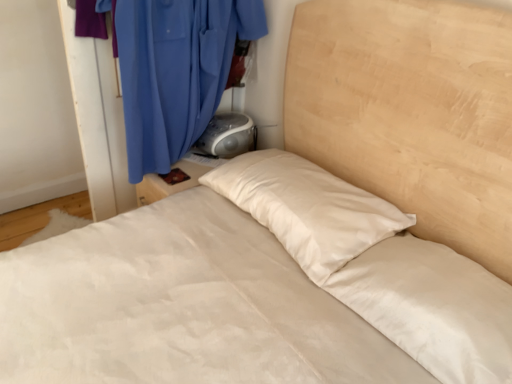
This screenshot has height=384, width=512. Describe the element at coordinates (175, 71) in the screenshot. I see `blue fabric curtain at upper left` at that location.

In order to face blue fabric curtain at upper left, should I rotate leftwards or rightwards?

It's best to rotate left around 9.432 degrees.

Locate an element on the screen. This screenshot has height=384, width=512. blue fabric curtain at upper left is located at coordinates (175, 71).

In order to face gray plastic radio at upper right, should I rotate leftwards or rightwards?

You should rotate left by 3.393 degrees.

Locate an element on the screen. The image size is (512, 384). gray plastic radio at upper right is located at coordinates (227, 136).

This screenshot has width=512, height=384. What do you see at coordinates (227, 136) in the screenshot?
I see `gray plastic radio at upper right` at bounding box center [227, 136].

You are a GUI agent. You are given a task and a screenshot of the screen. Output one action in this format:
    pyautogui.click(x=<x>, y=<y>)
    Task: Click on the blue fabric curtain at upper left
    
    Given the screenshot: What is the action you would take?
    pyautogui.click(x=175, y=71)

Considering the positions of objects gray plastic radio at upper right and blue fabric curtain at upper left in the image provided, who is more to the right, gray plastic radio at upper right or blue fabric curtain at upper left?

gray plastic radio at upper right.

Is gray plastic radio at upper right in front of or behind blue fabric curtain at upper left in the image?

Visually, gray plastic radio at upper right is located behind blue fabric curtain at upper left.

Which point is more distant from viewer, [228,138] or [164,108]?

Point [228,138]

From the image's perspective, is gray plastic radio at upper right located above or below blue fabric curtain at upper left?

gray plastic radio at upper right is below blue fabric curtain at upper left.

Consider the image. From a real-world perspective, is gray plastic radio at upper right physically located above or below blue fabric curtain at upper left?

gray plastic radio at upper right is below blue fabric curtain at upper left.

Which object is wider, gray plastic radio at upper right or blue fabric curtain at upper left?

Wider between the two is gray plastic radio at upper right.

Considering the relative sizes of gray plastic radio at upper right and blue fabric curtain at upper left in the image provided, is gray plastic radio at upper right shorter than blue fabric curtain at upper left?

Yes, gray plastic radio at upper right is shorter than blue fabric curtain at upper left.

Considering the relative sizes of gray plastic radio at upper right and blue fabric curtain at upper left in the image provided, is gray plastic radio at upper right bigger than blue fabric curtain at upper left?

No, gray plastic radio at upper right is not bigger than blue fabric curtain at upper left.

Is blue fabric curtain at upper left inside gray plastic radio at upper right?

Actually, blue fabric curtain at upper left is outside gray plastic radio at upper right.

Is there a large distance between gray plastic radio at upper right and blue fabric curtain at upper left?

No, there isn't a large distance between gray plastic radio at upper right and blue fabric curtain at upper left.

Does gray plastic radio at upper right turn towards blue fabric curtain at upper left?

Yes, gray plastic radio at upper right faces towards blue fabric curtain at upper left.

In the scene shown: Can you tell me how much gray plastic radio at upper right and blue fabric curtain at upper left differ in facing direction?

gray plastic radio at upper right and blue fabric curtain at upper left are facing 88 degrees away from each other.

How distant is gray plastic radio at upper right from blue fabric curtain at upper left?

gray plastic radio at upper right is 12.23 inches away from blue fabric curtain at upper left.

The image size is (512, 384). I want to click on curtain that appears on the left of gray plastic radio at upper right, so click(175, 71).

Between blue fabric curtain at upper left and gray plastic radio at upper right, which one appears on the left side from the viewer's perspective?

From the viewer's perspective, blue fabric curtain at upper left appears more on the left side.

Is blue fabric curtain at upper left in front of or behind gray plastic radio at upper right in the image?

Visually, blue fabric curtain at upper left is located in front of gray plastic radio at upper right.

Considering the positions of points (147, 46) and (241, 145), is point (147, 46) farther from camera compared to point (241, 145)?

That is False.

Based on the photo, from the image's perspective, relative to gray plastic radio at upper right, is blue fabric curtain at upper left above or below?

From the image's perspective, blue fabric curtain at upper left appears above gray plastic radio at upper right.

Consider the image. From a real-world perspective, is blue fabric curtain at upper left positioned above or below gray plastic radio at upper right?

blue fabric curtain at upper left is above gray plastic radio at upper right.

Considering the relative sizes of blue fabric curtain at upper left and gray plastic radio at upper right in the image provided, is blue fabric curtain at upper left wider than gray plastic radio at upper right?

Incorrect, the width of blue fabric curtain at upper left does not surpass that of gray plastic radio at upper right.

Considering the relative sizes of blue fabric curtain at upper left and gray plastic radio at upper right in the image provided, is blue fabric curtain at upper left shorter than gray plastic radio at upper right?

No.

Does blue fabric curtain at upper left have a larger size compared to gray plastic radio at upper right?

Correct, blue fabric curtain at upper left is larger in size than gray plastic radio at upper right.

Does blue fabric curtain at upper left contain gray plastic radio at upper right?

That's correct, gray plastic radio at upper right is inside blue fabric curtain at upper left.

Are blue fabric curtain at upper left and gray plastic radio at upper right beside each other?

No.

Is blue fabric curtain at upper left facing away from gray plastic radio at upper right?

Absolutely, blue fabric curtain at upper left is directed away from gray plastic radio at upper right.

What's the angular difference between blue fabric curtain at upper left and gray plastic radio at upper right's facing directions?

The angle between the facing direction of blue fabric curtain at upper left and the facing direction of gray plastic radio at upper right is 88 degrees.

I want to click on curtain on the left of gray plastic radio at upper right, so click(175, 71).

Locate an element on the screen. curtain that is above the gray plastic radio at upper right (from a real-world perspective) is located at coordinates (175, 71).

Where is `curtain above the gray plastic radio at upper right (from the image's perspective)`? curtain above the gray plastic radio at upper right (from the image's perspective) is located at coordinates (175, 71).